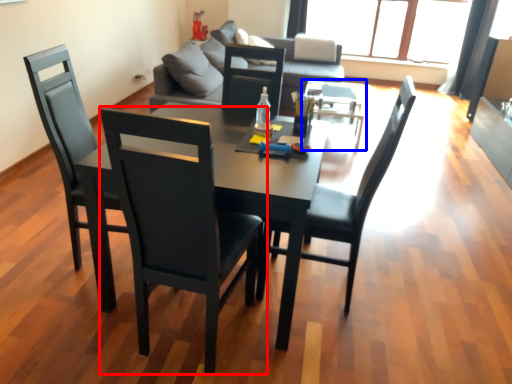
Question: Which object is further to the camera taking this photo, chair (highlighted by a red box) or coffee table (highlighted by a blue box)?

Choices:
 (A) chair
 (B) coffee table

Answer: (B)